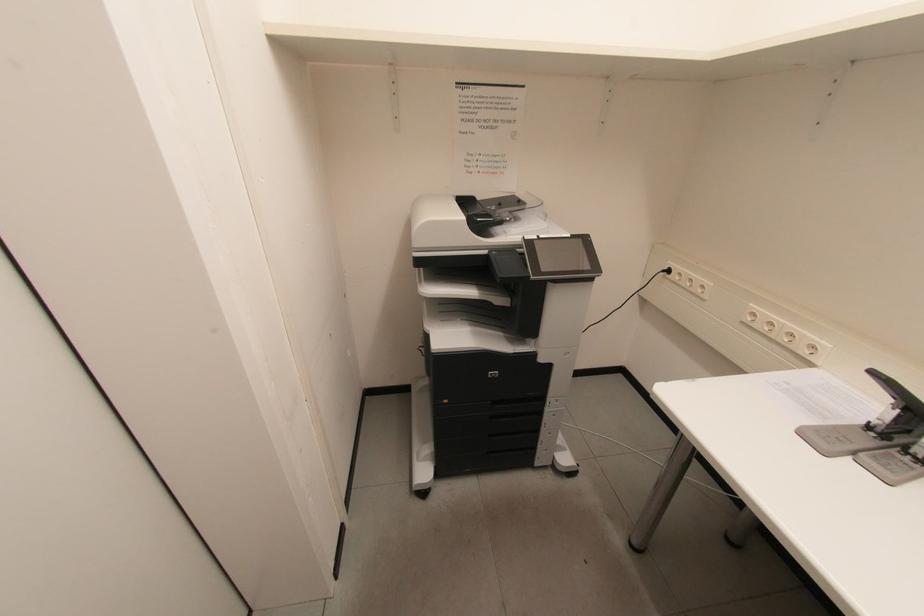
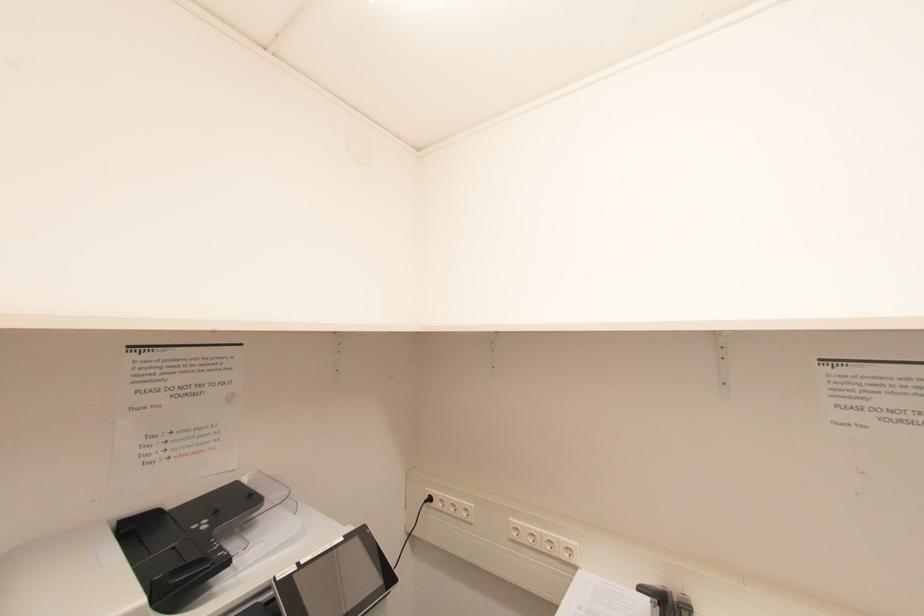
The first image is from the beginning of the video and the second image is from the end. How did the camera likely rotate when shooting the video?

The camera rotated toward right-up.